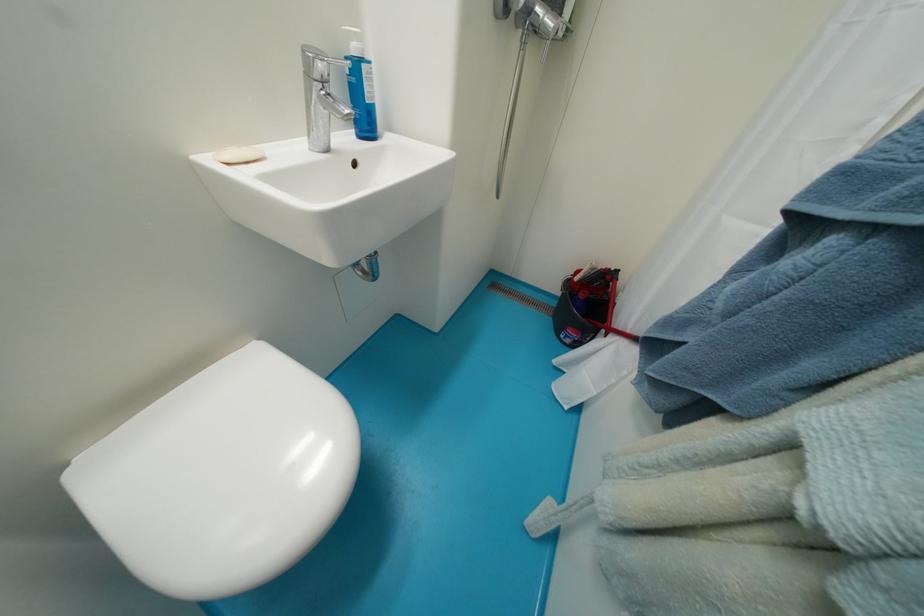
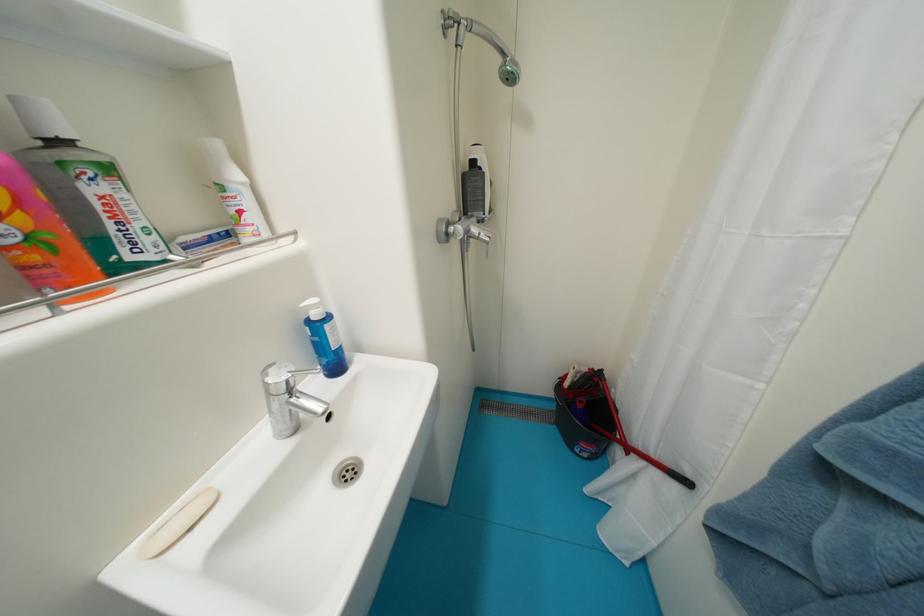
Question: Which direction would the cameraman need to move to produce the second image? Reply with the corresponding letter.

Choices:
 (A) Left
 (B) Right
 (C) Forward
 (D) Backward

Answer: (A)